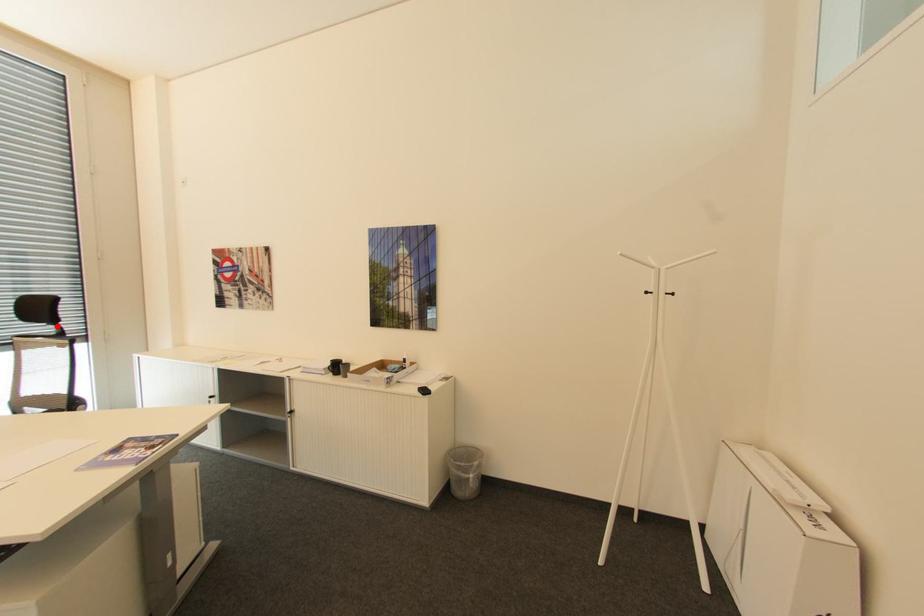
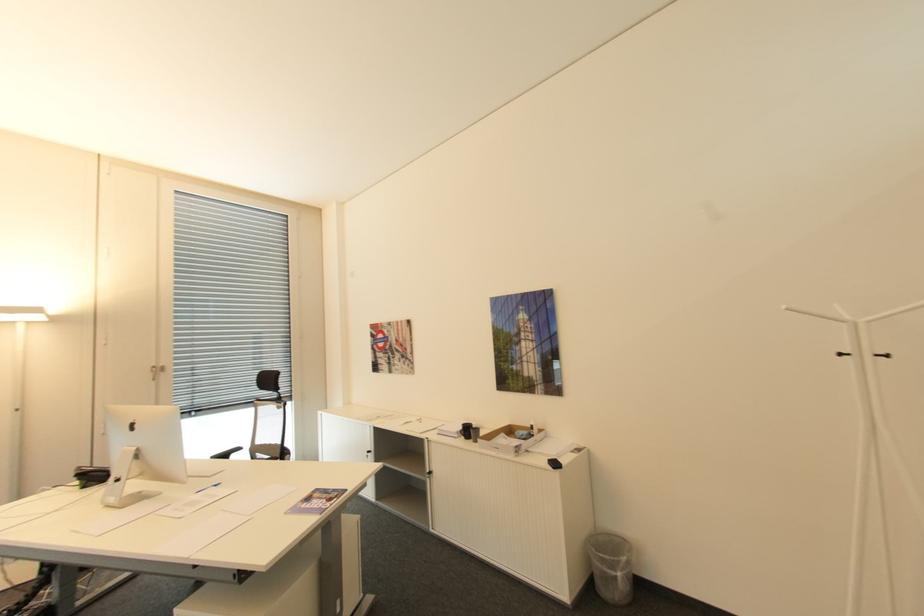
Question: I am providing you with two images of the same scene from different viewpoints. Given a red point in image1, look at the same physical point in image2. Is it:

Choices:
 (A) Closer to the viewpoint
 (B) Farther from the viewpoint

Answer: (B)